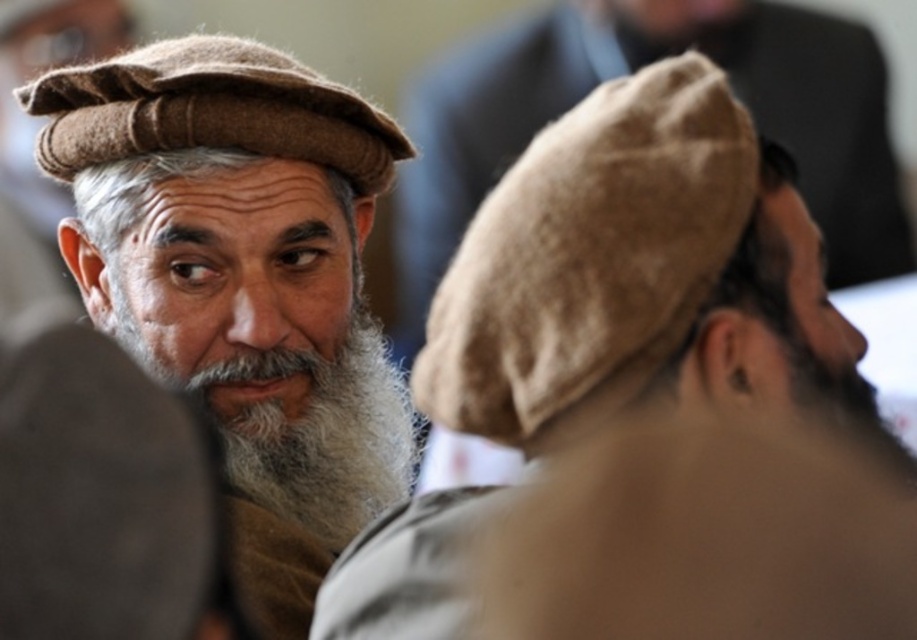
Can you confirm if matte brown cap at center is bigger than brown felt hat at upper center?

Correct, matte brown cap at center is larger in size than brown felt hat at upper center.

Does matte brown cap at center lie in front of brown felt hat at upper center?

No, matte brown cap at center is further to the viewer.

What are the coordinates of `matte brown cap at center` in the screenshot? It's located at (242, 284).

Is point (518, 276) farther from camera compared to point (305, 468)?

No, it is in front of (305, 468).

Does brown felt hat at upper center have a lesser height compared to graywoollybeard at center-left?

Yes.

Which is behind, point (562, 321) or point (410, 435)?

The point (410, 435) is more distant.

The image size is (917, 640). What are the coordinates of `brown felt hat at upper center` in the screenshot? It's located at (589, 257).

Does brown woolen cap at upper left appear under graywoollybeard at center-left?

No, brown woolen cap at upper left is not below graywoollybeard at center-left.

Who is higher up, brown woolen cap at upper left or graywoollybeard at center-left?

Positioned higher is brown woolen cap at upper left.

Is point (91, 74) positioned after point (324, 452)?

No, (91, 74) is closer to viewer.

What are the coordinates of `brown woolen cap at upper left` in the screenshot? It's located at (208, 109).